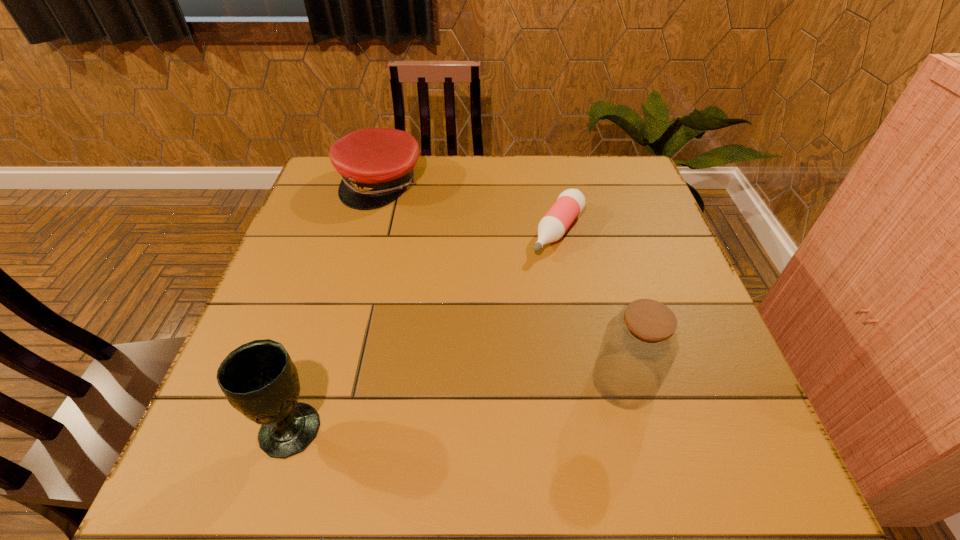
Locate an element on the screen. This screenshot has width=960, height=540. vacant space on the desktop that is between the chalice and the jar and is positioned on the front-facing side of the cap is located at coordinates (498, 399).

Image resolution: width=960 pixels, height=540 pixels. I want to click on free space on the desktop that is between the chalice and the jar and is positioned with the cap open on the bottle, so click(426, 408).